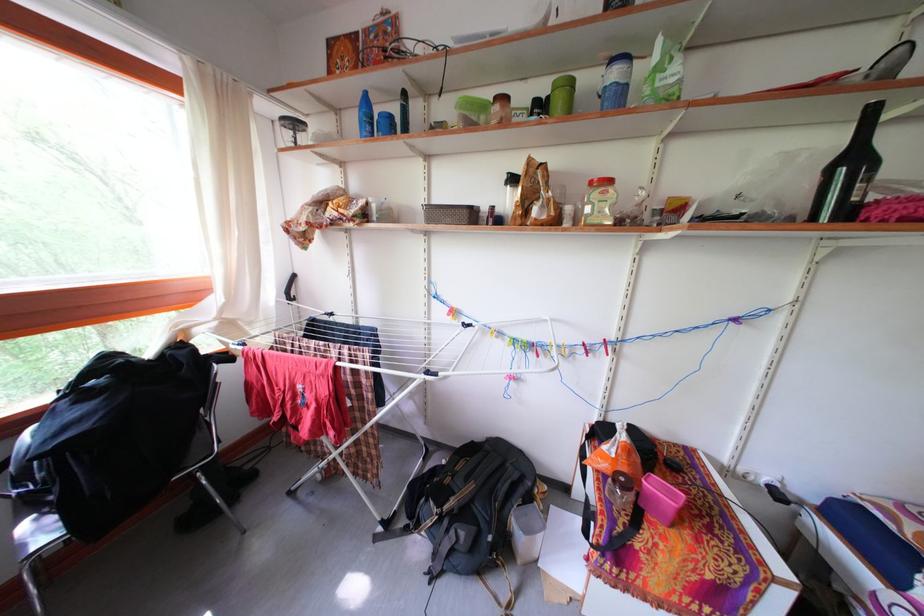
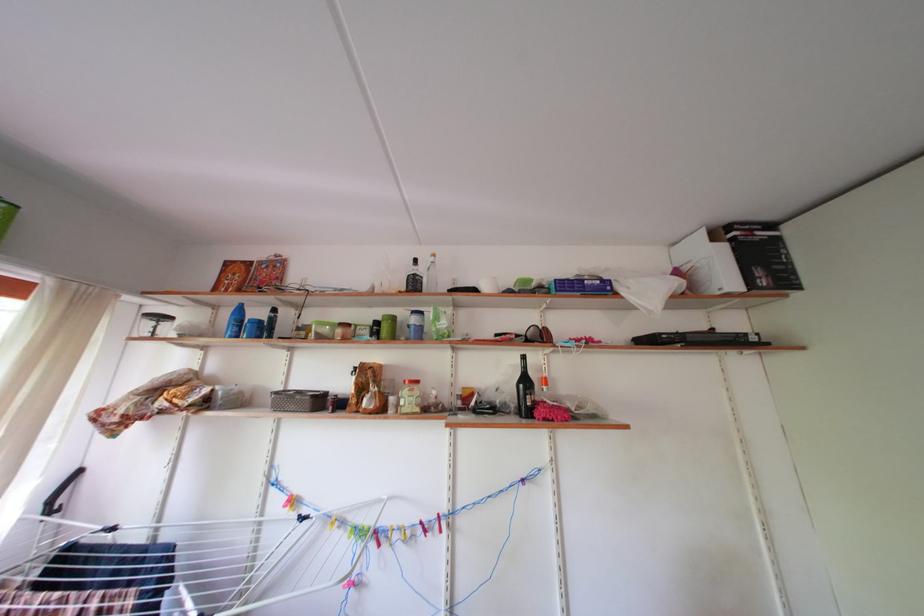
In the second image, find the point that corresponds to point 537,111 in the first image.

(380, 330)